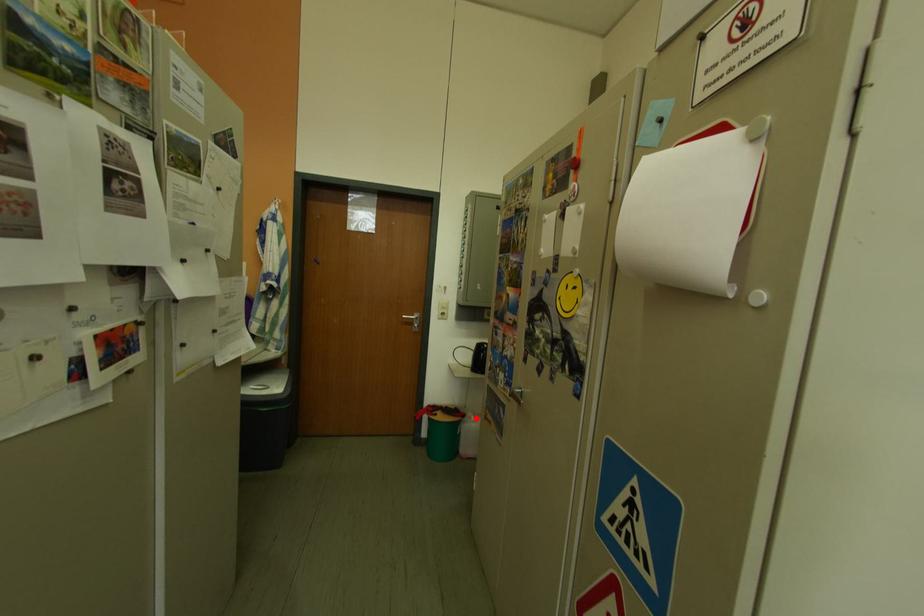
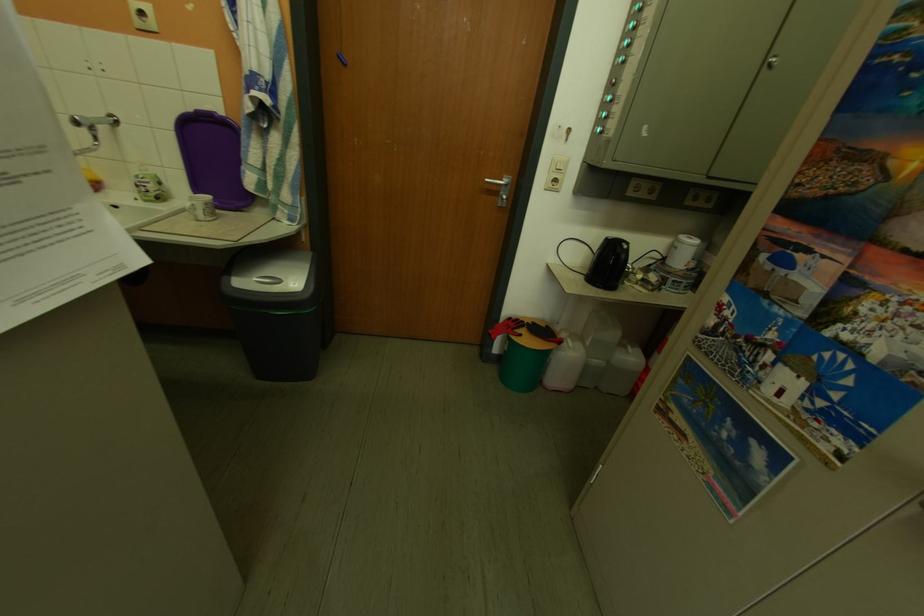
Locate, in the second image, the point that corresponds to the highlighted location in the first image.

(574, 345)